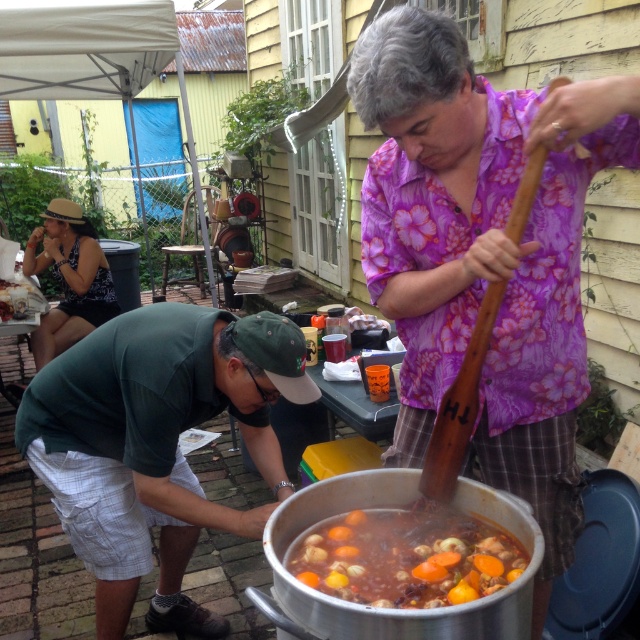
Question: Which point appears farthest from the camera in this image?

Choices:
 (A) (250, 532)
 (B) (381, 547)

Answer: (A)

Question: Is green fabric shirt at lower left thinner than matte black tank top at left?

Choices:
 (A) yes
 (B) no

Answer: (B)

Question: Can you confirm if green fabric cap at center is positioned above matte black tank top at left?

Choices:
 (A) yes
 (B) no

Answer: (B)

Question: Based on their relative distances, which object is nearer to the green fabric cap at center?

Choices:
 (A) carrot-studded broth at center
 (B) matte black tank top at left
 (C) green fabric shirt at lower left

Answer: (A)

Question: Is green fabric shirt at lower left thinner than carrot-studded broth at center?

Choices:
 (A) no
 (B) yes

Answer: (A)

Question: Which object is closer to the camera taking this photo?

Choices:
 (A) green fabric cap at center
 (B) matte black tank top at left

Answer: (A)